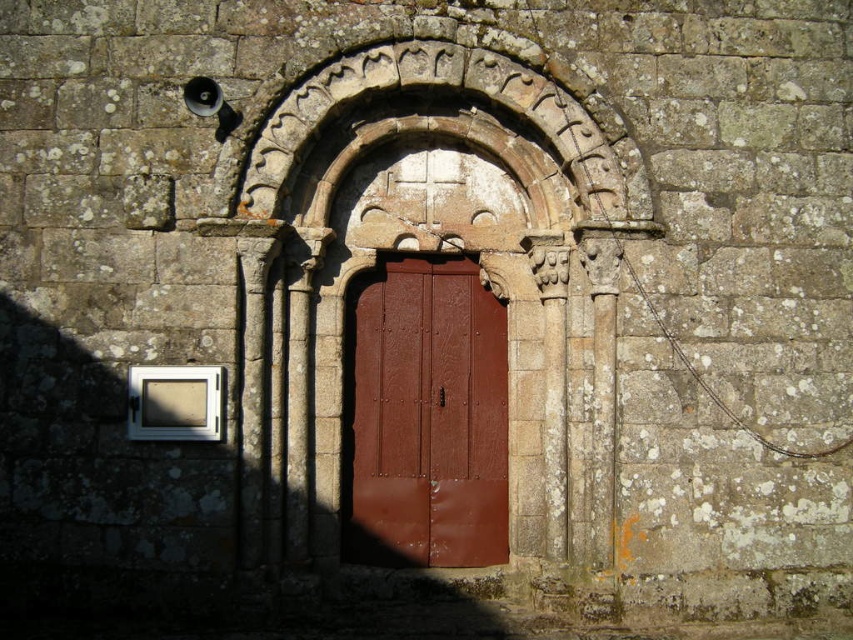
You are standing in a courtyard and want to take a photo of the stone carved archway at center. If you are currently 22.46 feet away from it, is that the closest you can get to it?

Yes, since the distance of stone carved archway at center from viewer is 22.46 feet, that is the closest you can get to it.

You are standing in front of the stone wall with the arched doorway. There are two points marked on the wall at coordinates point (431, 390) and point (445, 392). Which point is closer to you?

Point (431, 390) is closer to you because it is further to the viewer than point (445, 392).

You are an architect designing a new building and want to ensure the doorway aligns with the archway in terms of height. Given that the matte brown wooden door at center is 2 meters tall, what is the minimum height the stone carved archway at center should be to maintain the design requirement?

The stone carved archway at center is taller than the matte brown wooden door at center. Since the door is 2 meters tall, the archway must be at least 2 meters plus some additional height to meet the design requirement of being taller.